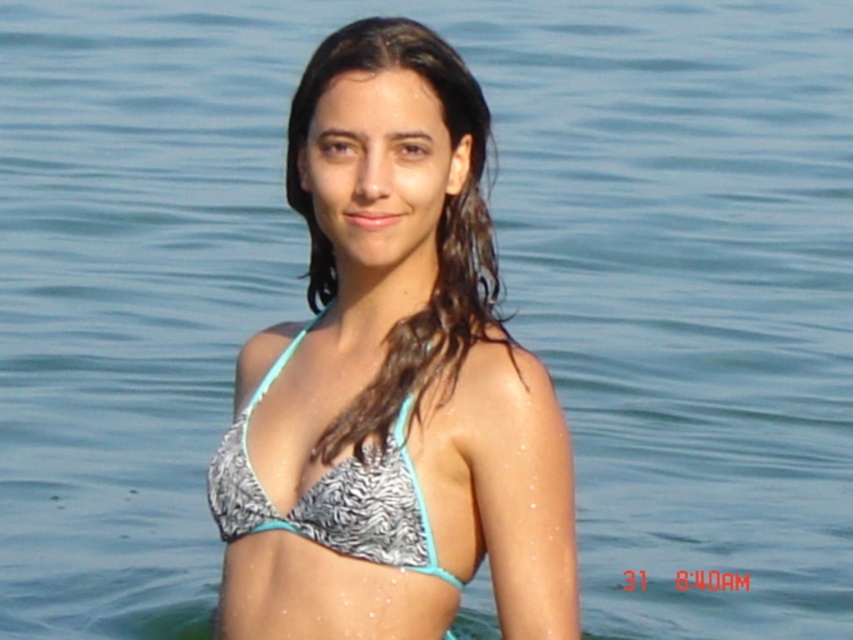
Identify the location of white printed bikini top at center. This screenshot has width=853, height=640. (392, 380).

Is white printed bikini top at center positioned before teal fabric bikini top at center?

Yes, white printed bikini top at center is in front of teal fabric bikini top at center.

You are a GUI agent. You are given a task and a screenshot of the screen. Output one action in this format:
    pyautogui.click(x=<x>, y=<y>)
    Task: Click on the white printed bikini top at center
    Image resolution: width=853 pixels, height=640 pixels.
    Given the screenshot: What is the action you would take?
    pyautogui.click(x=392, y=380)

Can you confirm if teal fabric bikini top at center is bigger than printed fabric bikini top at center?

Yes, teal fabric bikini top at center is bigger than printed fabric bikini top at center.

Which is behind, point (410, 60) or point (374, 538)?

Positioned behind is point (410, 60).

The width and height of the screenshot is (853, 640). In order to click on teal fabric bikini top at center in this screenshot , I will do (x=434, y=232).

You are a GUI agent. You are given a task and a screenshot of the screen. Output one action in this format:
    pyautogui.click(x=<x>, y=<y>)
    Task: Click on the teal fabric bikini top at center
    
    Given the screenshot: What is the action you would take?
    pyautogui.click(x=434, y=232)

Does white printed bikini top at center appear under printed fabric bikini top at center?

No, white printed bikini top at center is not below printed fabric bikini top at center.

Can you confirm if white printed bikini top at center is positioned to the right of printed fabric bikini top at center?

Yes, white printed bikini top at center is to the right of printed fabric bikini top at center.

The image size is (853, 640). Identify the location of white printed bikini top at center. (392, 380).

Locate an element on the screen. This screenshot has height=640, width=853. white printed bikini top at center is located at coordinates (x=392, y=380).